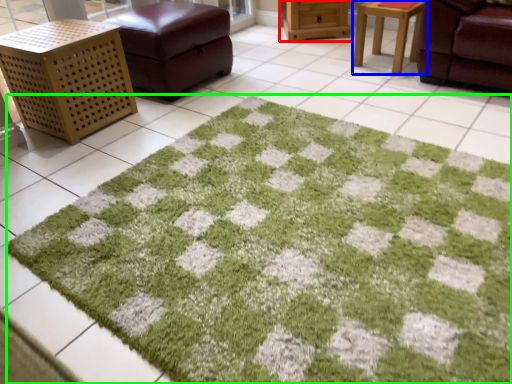
Question: Which object is positioned farthest from furniture (highlighted by a red box)? Select from table (highlighted by a blue box) and bath mat (highlighted by a green box).

Choices:
 (A) table
 (B) bath mat

Answer: (B)